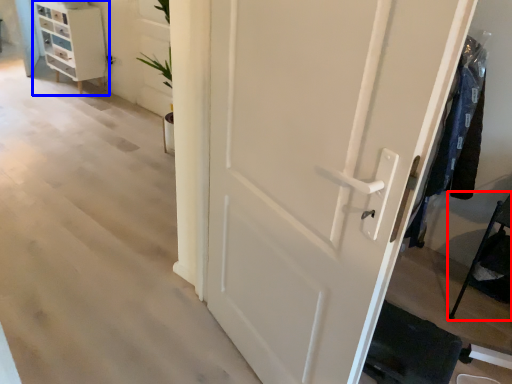
Question: Which object appears farthest to the camera in this image, furniture (highlighted by a red box) or chest of drawers (highlighted by a blue box)?

Choices:
 (A) furniture
 (B) chest of drawers

Answer: (B)